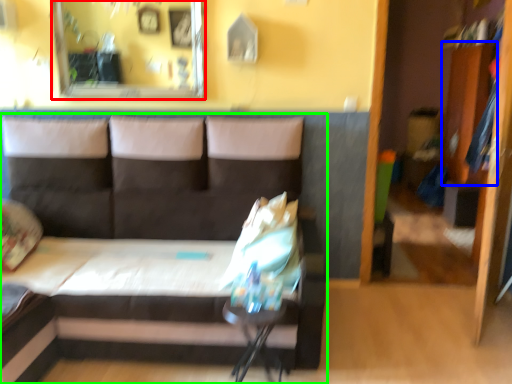
Question: Considering the real-world distances, which object is farthest from mirror (highlighted by a red box)? dresser (highlighted by a blue box) or studio couch (highlighted by a green box)?

Choices:
 (A) dresser
 (B) studio couch

Answer: (A)